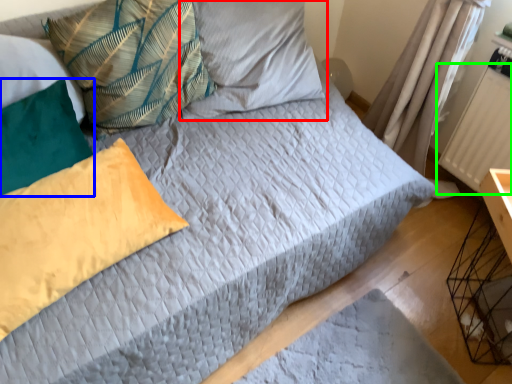
Question: Which object is positioned farthest from pillow (highlighted by a red box)? Select from pillow (highlighted by a blue box) and radiator (highlighted by a green box).

Choices:
 (A) pillow
 (B) radiator

Answer: (B)